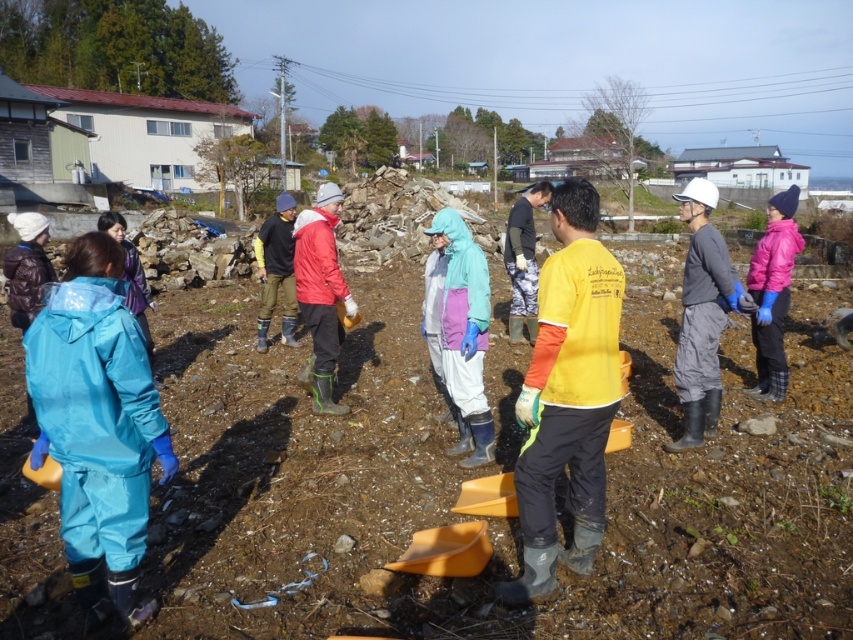
Who is positioned more to the right, brown soil at center or pink fleece jacket at right?

Positioned to the right is pink fleece jacket at right.

Is point (494, 570) positioned after point (787, 216)?

No, it is in front of (787, 216).

At what (x,y) coordinates should I click in order to perform the action: click on brown soil at center. Please return your answer as a coordinate pair (x, y). Looking at the image, I should click on (485, 474).

Image resolution: width=853 pixels, height=640 pixels. Find the location of `brown soil at center`. brown soil at center is located at coordinates (485, 474).

Measure the distance between brown soil at center and camera.

brown soil at center is 3.05 meters away from camera.

You are a GUI agent. You are given a task and a screenshot of the screen. Output one action in this format:
    pyautogui.click(x=<x>, y=<y>)
    Task: Click on the brown soil at center
    The height and width of the screenshot is (640, 853).
    Given the screenshot: What is the action you would take?
    (485, 474)

What do you see at coordinates (463, 333) in the screenshot? I see `light blue waterproof jacket at center` at bounding box center [463, 333].

Does light blue waterproof jacket at center appear on the left side of matte red jacket at center?

No, light blue waterproof jacket at center is not to the left of matte red jacket at center.

Locate an element on the screen. The image size is (853, 640). light blue waterproof jacket at center is located at coordinates (463, 333).

The image size is (853, 640). I want to click on light blue waterproof jacket at center, so click(x=463, y=333).